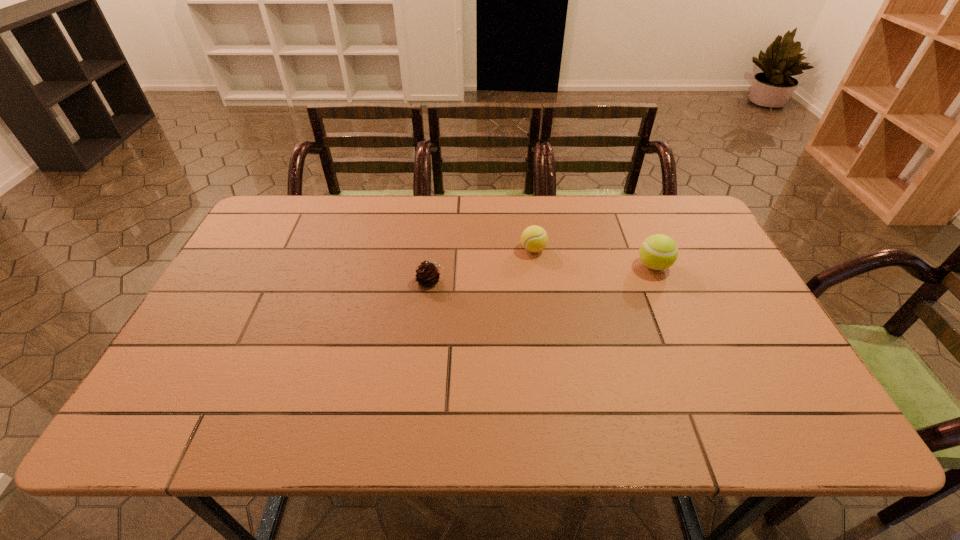
You are a GUI agent. You are given a task and a screenshot of the screen. Output one action in this format:
    pyautogui.click(x=<x>, y=<y>)
    Task: Click on the free space that is in between the tallest object and the leftmost object
    
    Given the screenshot: What is the action you would take?
    [542, 273]

Locate an element on the screen. The width and height of the screenshot is (960, 540). unoccupied area between the leftmost object and the second object from left to right is located at coordinates (482, 265).

At what (x,y) coordinates should I click in order to perform the action: click on free space between the pinecone and the tallest object. Please return your answer as a coordinate pair (x, y). The width and height of the screenshot is (960, 540). Looking at the image, I should click on (542, 273).

You are a GUI agent. You are given a task and a screenshot of the screen. Output one action in this format:
    pyautogui.click(x=<x>, y=<y>)
    Task: Click on the vacant point located between the taller tennis ball and the left tennis ball
    The width and height of the screenshot is (960, 540).
    Given the screenshot: What is the action you would take?
    click(x=593, y=258)

Where is `vacant region between the taller tennis ball and the leftmost object`? The image size is (960, 540). vacant region between the taller tennis ball and the leftmost object is located at coordinates (542, 273).

Image resolution: width=960 pixels, height=540 pixels. In order to click on the second closest object to the pinecone in this screenshot , I will do `click(658, 252)`.

Identify the location of object that is the second closest to the pinecone. (658, 252).

Locate an element on the screen. This screenshot has height=540, width=960. free location that satisfies the following two spatial constraints: 1. on the front side of the rightmost object; 2. with a leaf charm attached to the pinecone is located at coordinates (660, 281).